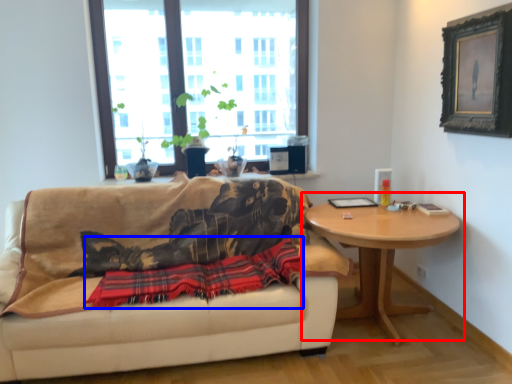
Question: Which of the following is the closest to the observer, coffee table (highlighted by a red box) or plaid (highlighted by a blue box)?

Choices:
 (A) coffee table
 (B) plaid

Answer: (B)